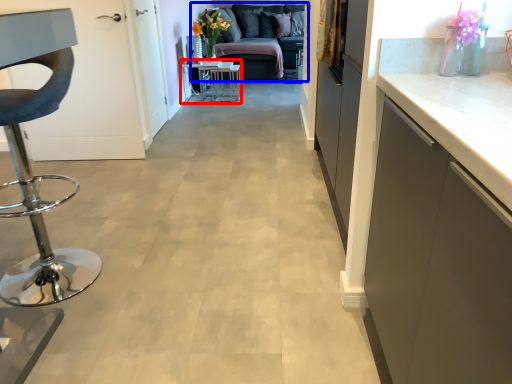
Question: Which point is further to the camera, table (highlighted by a red box) or studio couch (highlighted by a blue box)?

Choices:
 (A) table
 (B) studio couch

Answer: (B)